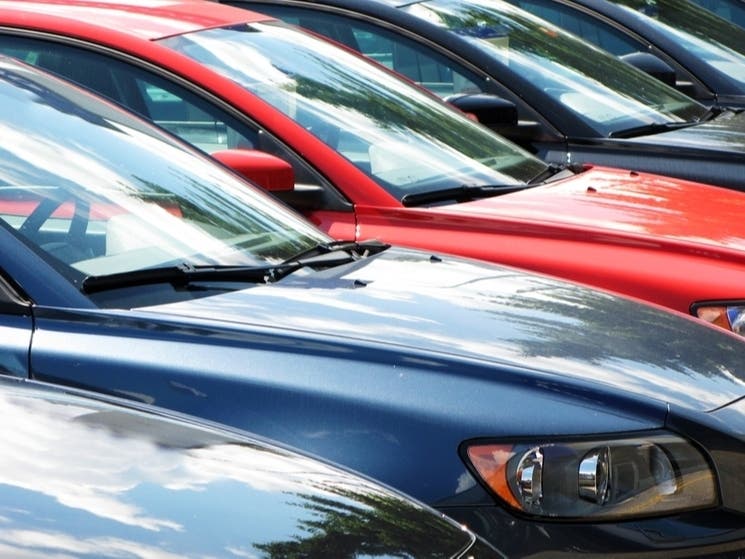
The width and height of the screenshot is (745, 559). What are the coordinates of `hoods` in the screenshot? It's located at [x=218, y=505], [x=494, y=312], [x=656, y=210], [x=717, y=132].